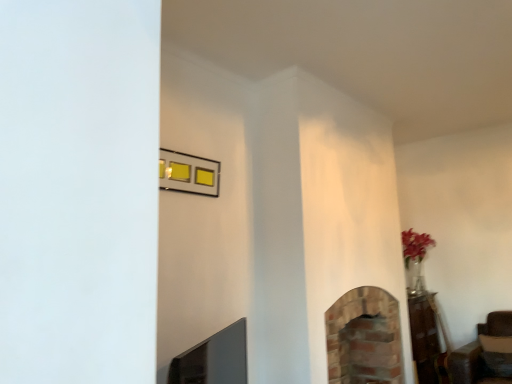
Question: Is brick fireplace at center, which appears as the 2th fireplace when viewed from the front, looking in the opposite direction of brick fireplace at lower center, the first fireplace when ordered from left to right?

Choices:
 (A) yes
 (B) no

Answer: (B)

Question: Does brick fireplace at center, which is the 1th fireplace from right to left, have a lesser height compared to brick fireplace at lower center, the second fireplace viewed from the right?

Choices:
 (A) no
 (B) yes

Answer: (A)

Question: From the image's perspective, is brick fireplace at center, the second fireplace in the left-to-right sequence, on brick fireplace at lower center, positioned as the 2th fireplace in back-to-front order?

Choices:
 (A) no
 (B) yes

Answer: (A)

Question: Can you confirm if brick fireplace at center, the second fireplace in the left-to-right sequence, is positioned to the left of brick fireplace at lower center, marked as the first fireplace in a front-to-back arrangement?

Choices:
 (A) yes
 (B) no

Answer: (B)

Question: Is brick fireplace at center, the 1th fireplace viewed from the back, surrounding brick fireplace at lower center, the second fireplace viewed from the right?

Choices:
 (A) yes
 (B) no

Answer: (B)

Question: From a real-world perspective, is brick fireplace at center, the 1th fireplace viewed from the back, positioned over brick fireplace at lower center, the first fireplace when ordered from left to right, based on gravity?

Choices:
 (A) yes
 (B) no

Answer: (B)

Question: From a real-world perspective, is brick fireplace at lower center, the second fireplace viewed from the right, beneath metallic gold picture frame at upper center?

Choices:
 (A) yes
 (B) no

Answer: (A)

Question: Can metallic gold picture frame at upper center be found inside brick fireplace at lower center, the first fireplace when ordered from left to right?

Choices:
 (A) no
 (B) yes

Answer: (A)

Question: Is brick fireplace at lower center, positioned as the 2th fireplace in back-to-front order, next to metallic gold picture frame at upper center?

Choices:
 (A) no
 (B) yes

Answer: (A)

Question: Is brick fireplace at lower center, the first fireplace when ordered from left to right, thinner than metallic gold picture frame at upper center?

Choices:
 (A) yes
 (B) no

Answer: (B)

Question: From the image's perspective, does brick fireplace at lower center, the second fireplace viewed from the right, appear lower than metallic gold picture frame at upper center?

Choices:
 (A) no
 (B) yes

Answer: (B)

Question: Considering the relative positions of brick fireplace at lower center, the second fireplace viewed from the right, and metallic gold picture frame at upper center in the image provided, is brick fireplace at lower center, the second fireplace viewed from the right, to the left of metallic gold picture frame at upper center from the viewer's perspective?

Choices:
 (A) yes
 (B) no

Answer: (B)

Question: From the image's perspective, is metallic gold picture frame at upper center beneath brick fireplace at center, which appears as the 2th fireplace when viewed from the front?

Choices:
 (A) yes
 (B) no

Answer: (B)